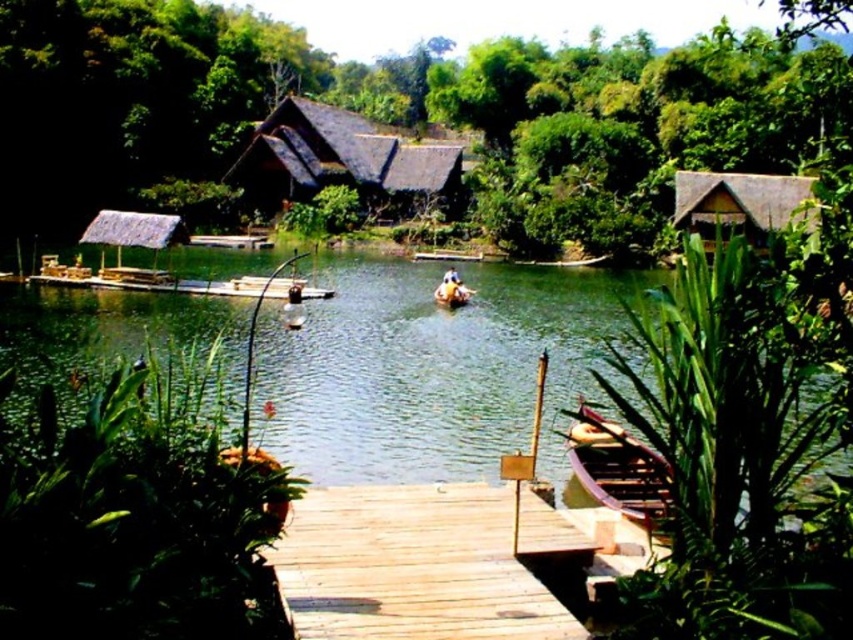
Question: Can you confirm if wooden dock at center is positioned to the right of brown thatched hut at center?

Choices:
 (A) yes
 (B) no

Answer: (A)

Question: Estimate the real-world distances between objects in this image. Which object is farther from the wooden boat at lower right?

Choices:
 (A) brown thatched hut at center
 (B) brown leather boat at center
 (C) green leafy plant at lower right

Answer: (A)

Question: Which object appears farthest from the camera in this image?

Choices:
 (A) thatched straw hut at left
 (B) green leafy plant at lower left
 (C) brown thatched hut at center
 (D) green leafy plant at lower right

Answer: (C)

Question: Is brown thatched hut at center thinner than brown leather boat at center?

Choices:
 (A) yes
 (B) no

Answer: (B)

Question: Can you confirm if green leafy vegetation at upper center is positioned above thatched wood hut at upper right?

Choices:
 (A) yes
 (B) no

Answer: (A)

Question: Which point is closer to the camera taking this photo?

Choices:
 (A) (608, 449)
 (B) (445, 280)

Answer: (A)